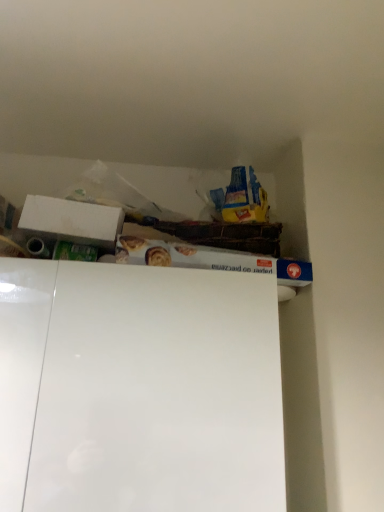
Question: From a real-world perspective, relative to white cardboard box at upper left, is white glossy cabinet at upper center vertically above or below?

Choices:
 (A) below
 (B) above

Answer: (A)

Question: Does point (104, 501) appear closer or farther from the camera than point (46, 219)?

Choices:
 (A) closer
 (B) farther

Answer: (A)

Question: Considering the positions of white glossy cabinet at upper center and white cardboard box at upper left in the image, is white glossy cabinet at upper center taller or shorter than white cardboard box at upper left?

Choices:
 (A) short
 (B) tall

Answer: (B)

Question: From a real-world perspective, relative to white glossy cabinet at upper center, is white cardboard box at upper left vertically above or below?

Choices:
 (A) above
 (B) below

Answer: (A)

Question: Would you say white cardboard box at upper left is inside or outside white glossy cabinet at upper center?

Choices:
 (A) outside
 (B) inside

Answer: (A)

Question: Looking at their shapes, would you say white cardboard box at upper left is wider or thinner than white glossy cabinet at upper center?

Choices:
 (A) wide
 (B) thin

Answer: (B)

Question: Considering the positions of point (24, 209) and point (218, 318), is point (24, 209) closer or farther from the camera than point (218, 318)?

Choices:
 (A) closer
 (B) farther

Answer: (B)